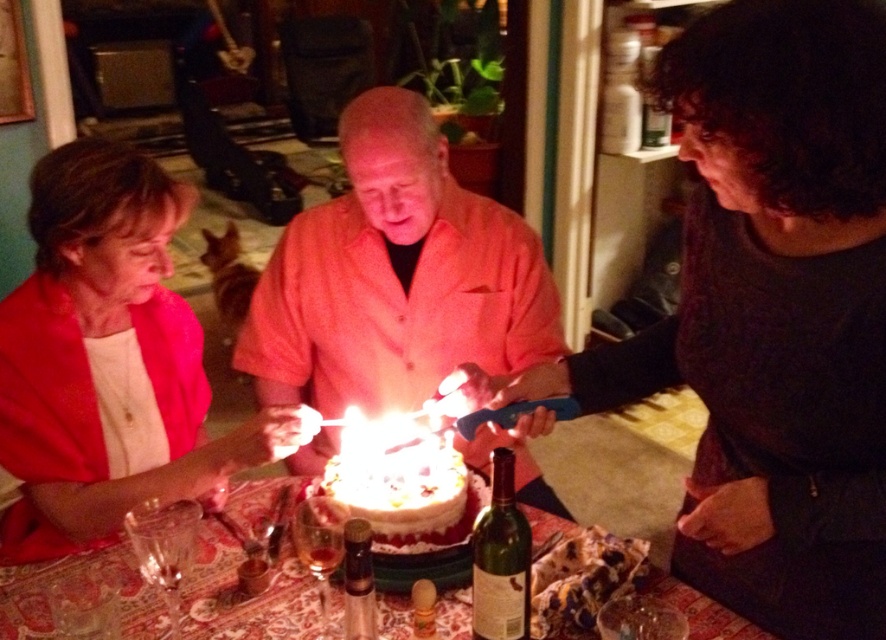
Question: Which point appears closest to the camera in this image?

Choices:
 (A) (532, 288)
 (B) (394, 444)

Answer: (B)

Question: Is matte orange shirt at center above white frosted cake at center?

Choices:
 (A) no
 (B) yes

Answer: (B)

Question: Is matte orange shirt at center to the right of white frosted cake at center from the viewer's perspective?

Choices:
 (A) yes
 (B) no

Answer: (A)

Question: Among these points, which one is nearest to the camera?

Choices:
 (A) 74,388
 (B) 389,442
 (C) 286,560

Answer: (C)

Question: Estimate the real-world distances between objects in this image. Which object is farther from the white frosted cake at center?

Choices:
 (A) matte orange shirt at center
 (B) matte pink sweater at left

Answer: (B)

Question: Does matte orange shirt at center have a larger size compared to patterned fabric tablecloth at center?

Choices:
 (A) yes
 (B) no

Answer: (A)